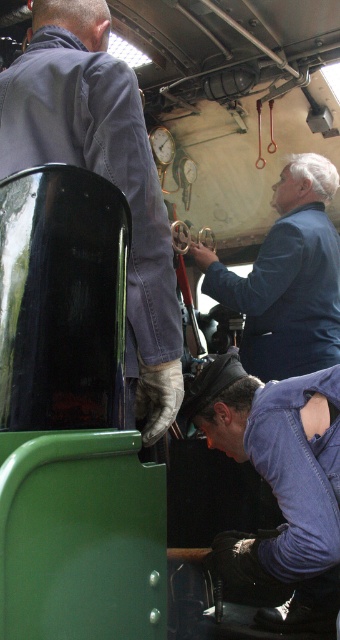
Question: Based on their relative distances, which object is farther from the dark blue denim jeans at lower center?

Choices:
 (A) denim jacket at upper left
 (B) blue matte jacket at upper center

Answer: (A)

Question: Does dark blue denim jeans at lower center come in front of blue matte jacket at upper center?

Choices:
 (A) yes
 (B) no

Answer: (A)

Question: Which is nearer to the blue matte jacket at upper center?

Choices:
 (A) denim jacket at upper left
 (B) dark blue denim jeans at lower center

Answer: (B)

Question: Among these points, which one is farthest from the camera?

Choices:
 (A) (41, 129)
 (B) (274, 346)
 (C) (324, 611)

Answer: (B)

Question: Does dark blue denim jeans at lower center lie in front of blue matte jacket at upper center?

Choices:
 (A) no
 (B) yes

Answer: (B)

Question: Does dark blue denim jeans at lower center appear over blue matte jacket at upper center?

Choices:
 (A) no
 (B) yes

Answer: (A)